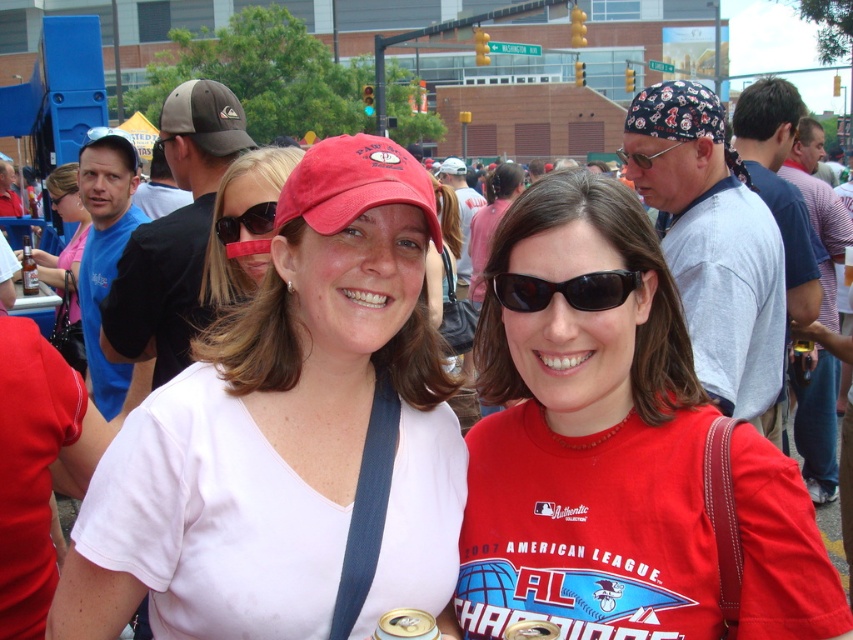
Question: Does matte white shirt at center have a smaller size compared to matte red baseball cap at center?

Choices:
 (A) yes
 (B) no

Answer: (B)

Question: Can you confirm if matte white shirt at center is positioned to the right of matte red baseball cap at center?

Choices:
 (A) no
 (B) yes

Answer: (B)

Question: Which point appears closest to the camera in this image?

Choices:
 (A) (595, 285)
 (B) (378, 202)
 (C) (71, 168)

Answer: (B)

Question: Which object appears closest to the camera in this image?

Choices:
 (A) matte black cap at upper left
 (B) black plastic sunglasses at center
 (C) matte red cap at center

Answer: (B)

Question: Does white matte shirt at center have a greater width compared to matte white shirt at center?

Choices:
 (A) no
 (B) yes

Answer: (B)

Question: Which of the following is the closest to the observer?

Choices:
 (A) sunglasses at center
 (B) metallic reflective goggles at center

Answer: (A)